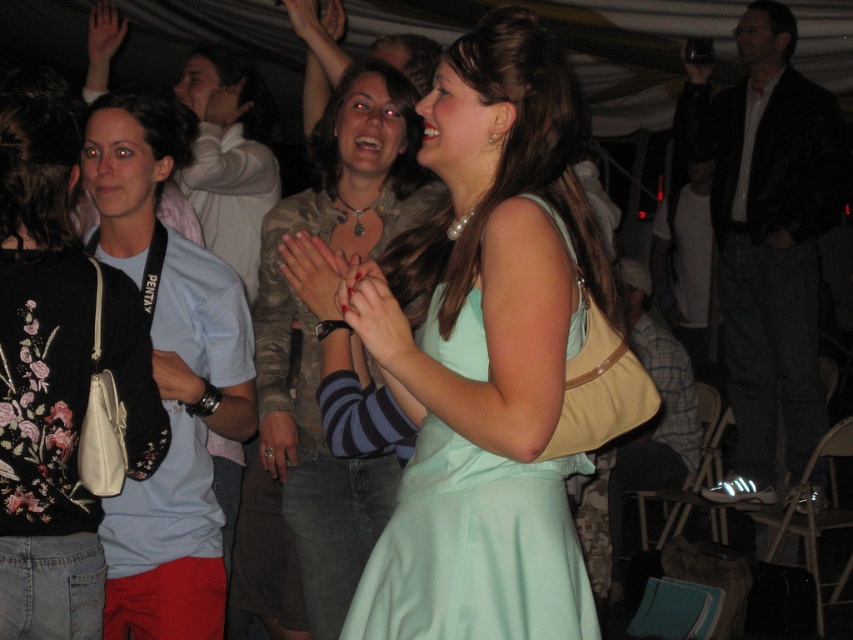
In the scene shown: You are a photographer at the event and need to capture a photo that includes both the matte black purse at left and the camouflage fabric jacket at center. What is the minimum distance you need to maintain between the camera and the subjects to ensure both are in frame?

The minimum distance required to ensure both the matte black purse at left and the camouflage fabric jacket at center are in frame is 82.41 centimeters.

You are at a party and need to decide which item to grab first. The light teal dress at center and the camouflage fabric jacket at center are both on a rack. Which one is shorter?

The light teal dress at center is shorter than the camouflage fabric jacket at center.

You are standing at the camera position and want to take a photo of the woman in the light teal dress. The camera has a focal length of 50mm. If the woman is at point (459, 445), which is 5.52 feet away from the camera, what is the approximate distance in feet between the woman in the light teal dress and the woman in the light blue shirt and red shorts?

The distance between the two women cannot be determined with the provided information because the coordinates and distance given are only for the point where the woman in the light teal dress is located relative to the camera. Without additional spatial data about the position of the woman in the light blue shirt and red shorts, an accurate calculation is not possible.